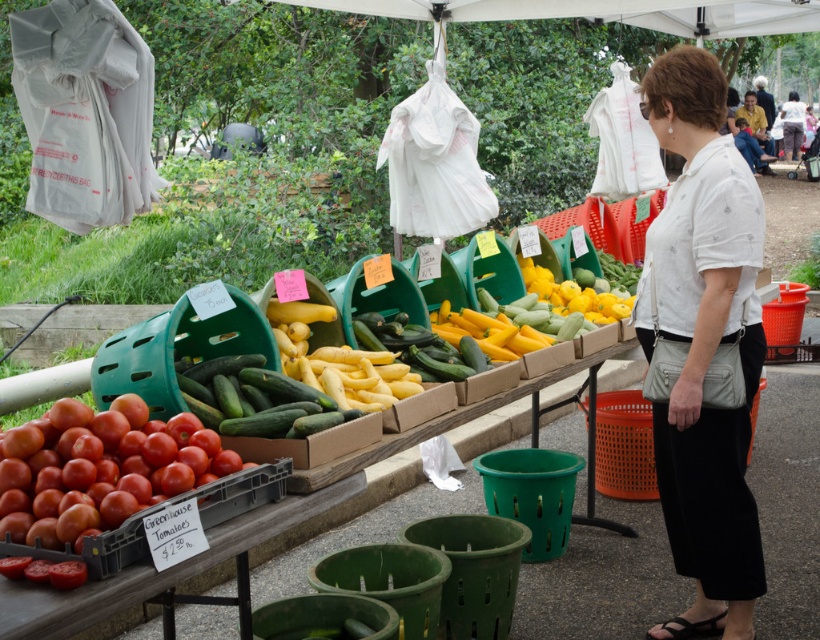
You are a customer at the market and want to place your matte white blouse at center on the table without wrinkling it. The green matte cucumber at center is currently in the way. Can you move the cucumber to make space?

The green matte cucumber at center is narrower than the matte white blouse at center, so moving it aside would create enough space to place the blouse without wrinkling.

You are a customer at the farmer market and want to buy both the white printed blouse at center and the shiny red tomatoes at lower left. The vendor has a rule that if one item is larger than the other, you must place the larger item in the bag first. Which item should you place in the bag first?

The white printed blouse at center is larger in size than the shiny red tomatoes at lower left, so you should place the white printed blouse at center first.

You are a customer at the farmer market and want to pick up both the white printed blouse at center and the shiny red tomatoes at lower left. Which item will you reach first if you approach the table from the front?

The white printed blouse at center is closer to you than the shiny red tomatoes at lower left, so you will reach the white printed blouse at center first.